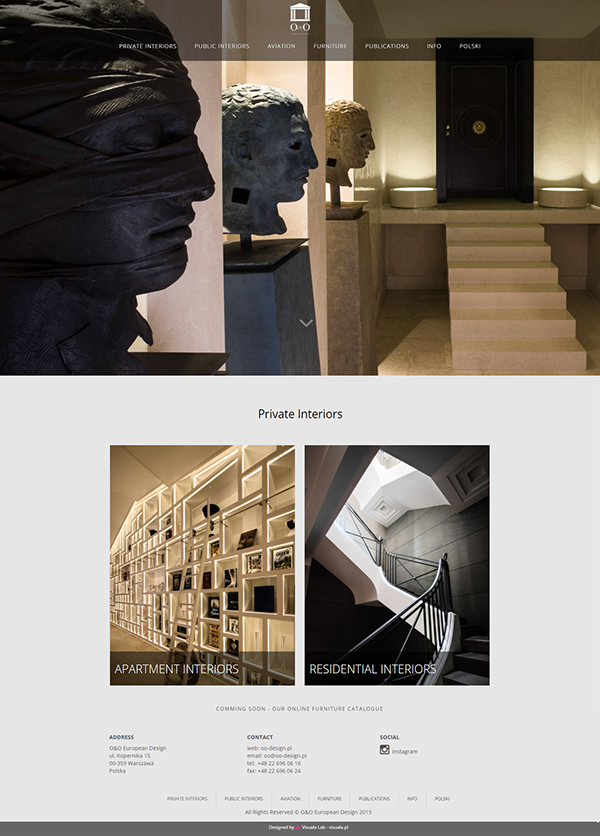
Locate an element on the screen. blue colored statue of a head is located at coordinates (264, 150).